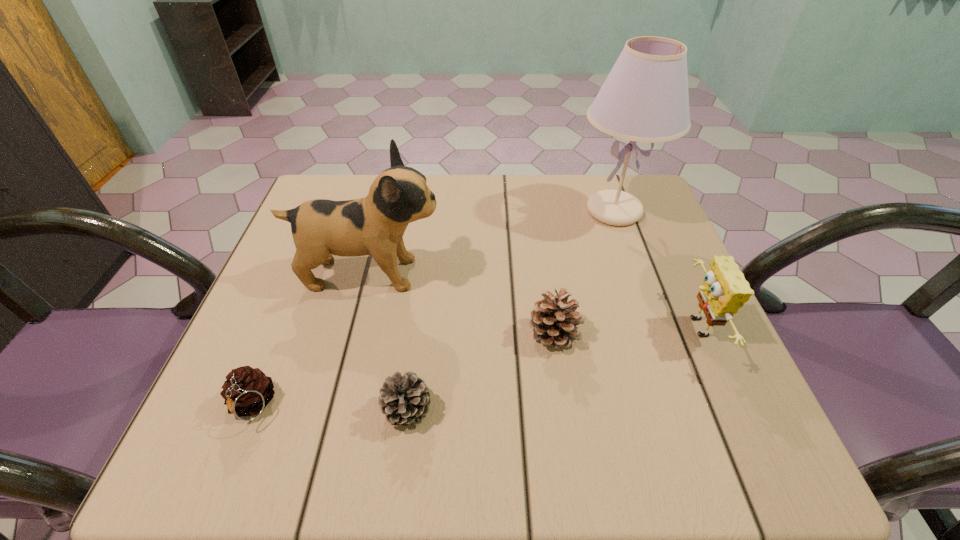
The image size is (960, 540). Find the location of `vacant point that satisfies the following two spatial constraints: 1. at the face of the puppy; 2. on the right side of the second pinecone from left to right`. vacant point that satisfies the following two spatial constraints: 1. at the face of the puppy; 2. on the right side of the second pinecone from left to right is located at coordinates (335, 409).